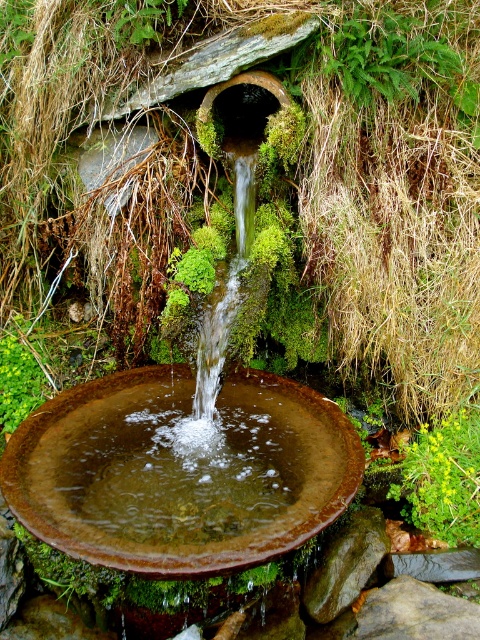
Question: Is rusty metal bird bath at center bigger than green leafy plant at lower right?

Choices:
 (A) no
 (B) yes

Answer: (B)

Question: Considering the real-world distances, which object is farthest from the green leafy plant at lower right?

Choices:
 (A) brown rough stone at center
 (B) rusty metal bird bath at center

Answer: (B)

Question: Which point appears closest to the camera in this image?

Choices:
 (A) (419, 467)
 (B) (402, 620)

Answer: (B)

Question: Does rusty metal bird bath at center have a larger size compared to brown rough stone at center?

Choices:
 (A) yes
 (B) no

Answer: (A)

Question: Is rusty metal bird bath at center further to camera compared to brown rough stone at center?

Choices:
 (A) no
 (B) yes

Answer: (A)

Question: Which object appears closest to the camera in this image?

Choices:
 (A) green leafy plant at lower right
 (B) rusty metal bird bath at center
 (C) brown rough stone at center

Answer: (B)